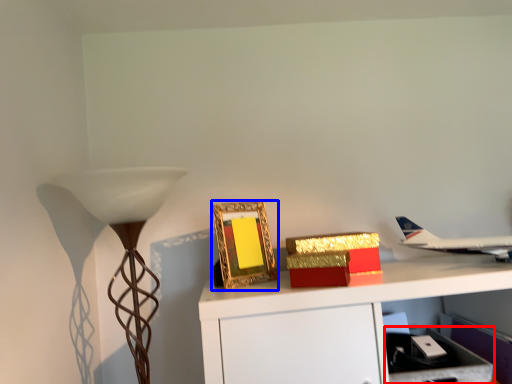
Question: Among these objects, which one is nearest to the camera, drawer (highlighted by a red box) or picture frame (highlighted by a blue box)?

Choices:
 (A) drawer
 (B) picture frame

Answer: (A)